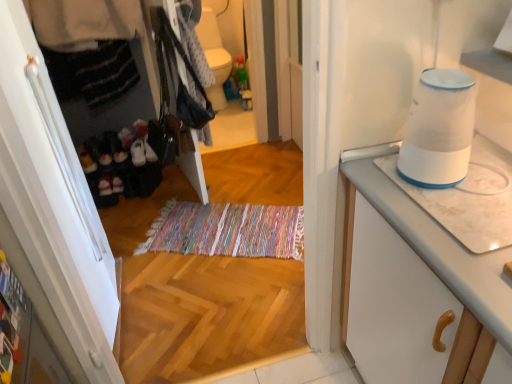
Question: Could white glossy toilet bowl at upper center be considered to be inside white marble countertop at right?

Choices:
 (A) yes
 (B) no

Answer: (B)

Question: Is white marble countertop at right touching white glossy toilet bowl at upper center?

Choices:
 (A) yes
 (B) no

Answer: (B)

Question: Is white marble countertop at right smaller than white glossy toilet bowl at upper center?

Choices:
 (A) no
 (B) yes

Answer: (A)

Question: Is white marble countertop at right oriented away from white glossy toilet bowl at upper center?

Choices:
 (A) no
 (B) yes

Answer: (A)

Question: Can you confirm if white marble countertop at right is taller than white glossy toilet bowl at upper center?

Choices:
 (A) no
 (B) yes

Answer: (B)

Question: In terms of height, does white marble countertop at right look taller or shorter compared to white matte cabinet at left?

Choices:
 (A) short
 (B) tall

Answer: (A)

Question: In terms of width, does white marble countertop at right look wider or thinner when compared to white matte cabinet at left?

Choices:
 (A) thin
 (B) wide

Answer: (B)

Question: Considering the positions of white marble countertop at right and white matte cabinet at left in the image, is white marble countertop at right bigger or smaller than white matte cabinet at left?

Choices:
 (A) small
 (B) big

Answer: (A)

Question: From a real-world perspective, relative to white matte cabinet at left, is white marble countertop at right vertically above or below?

Choices:
 (A) below
 (B) above

Answer: (A)

Question: Is point (402, 162) positioned closer to the camera than point (399, 230)?

Choices:
 (A) farther
 (B) closer

Answer: (A)

Question: Considering the positions of white plastic humidifier at upper right and white marble countertop at right in the image, is white plastic humidifier at upper right wider or thinner than white marble countertop at right?

Choices:
 (A) wide
 (B) thin

Answer: (B)

Question: Which is correct: white plastic humidifier at upper right is inside white marble countertop at right, or outside of it?

Choices:
 (A) outside
 (B) inside

Answer: (A)

Question: Considering the positions of white plastic humidifier at upper right and white marble countertop at right in the image, is white plastic humidifier at upper right bigger or smaller than white marble countertop at right?

Choices:
 (A) small
 (B) big

Answer: (A)

Question: In terms of size, does white plastic humidifier at upper right appear bigger or smaller than white matte cabinet at left?

Choices:
 (A) big
 (B) small

Answer: (B)

Question: From a real-world perspective, is white plastic humidifier at upper right physically located above or below white matte cabinet at left?

Choices:
 (A) below
 (B) above

Answer: (B)